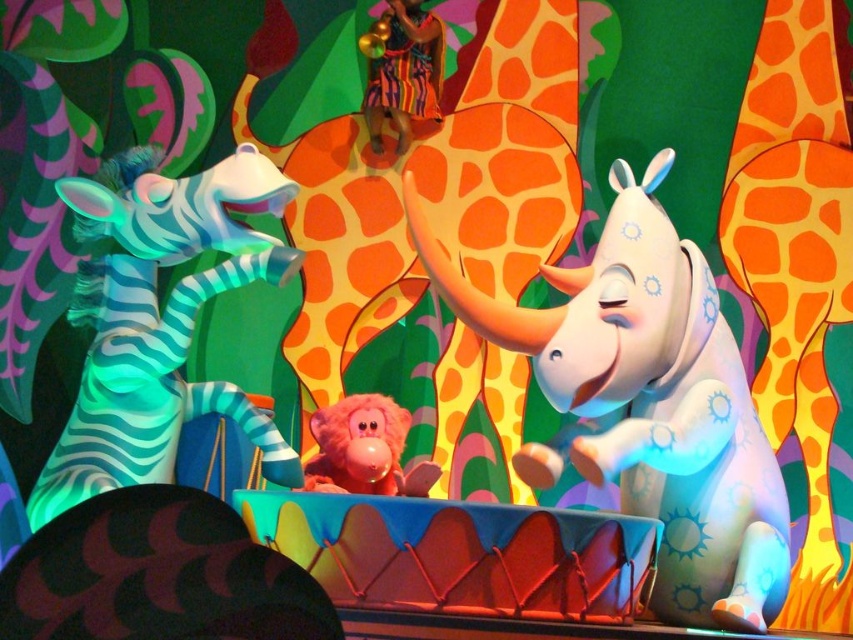
Is shiny white rhino at center to the right of pink plush monkey at center from the viewer's perspective?

Yes, shiny white rhino at center is to the right of pink plush monkey at center.

Between point (672, 380) and point (380, 449), which one is positioned in front?

Point (672, 380)

The image size is (853, 640). What are the coordinates of `shiny white rhino at center` in the screenshot? It's located at (651, 401).

What do you see at coordinates (160, 320) in the screenshot? I see `teal glossy zebra at left` at bounding box center [160, 320].

The image size is (853, 640). What are the coordinates of `teal glossy zebra at left` in the screenshot? It's located at (160, 320).

The image size is (853, 640). Identify the location of teal glossy zebra at left. (160, 320).

Who is more distant from viewer, [486,392] or [757,218]?

The point [757,218] is more distant.

Between orange spotted giraffe at center and orange spotted fabric at right, which one is positioned lower?

orange spotted fabric at right is below.

Locate an element on the screen. Image resolution: width=853 pixels, height=640 pixels. orange spotted giraffe at center is located at coordinates (444, 241).